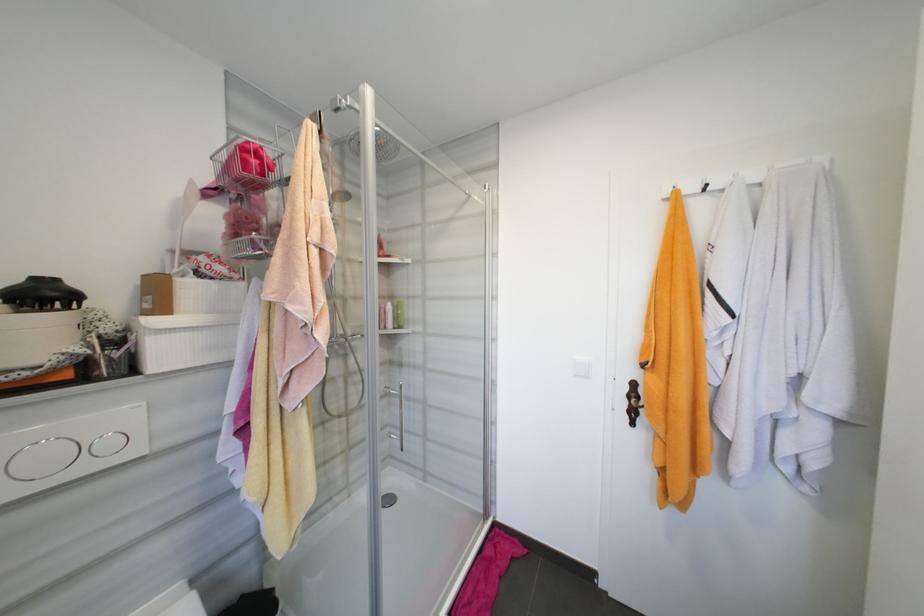
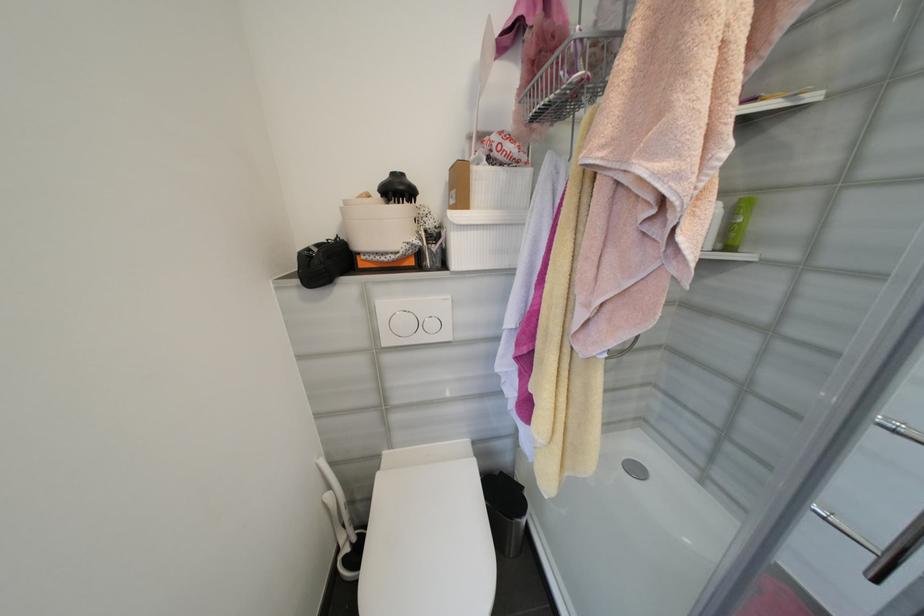
The images are taken continuously from a first-person perspective. In which direction is your viewpoint rotating?

The rotation direction of the camera is left-down.